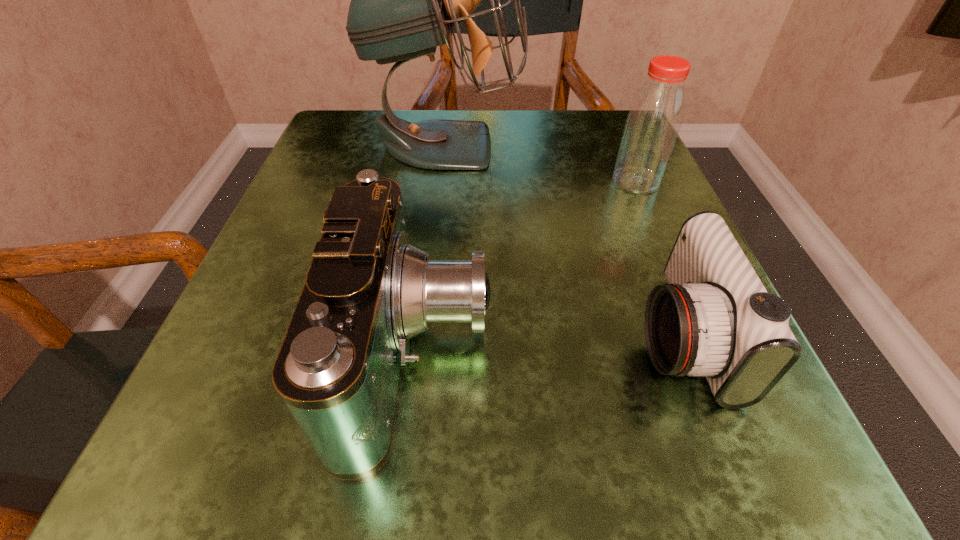
Where is `object that is at the near left corner`? object that is at the near left corner is located at coordinates (368, 291).

Locate an element on the screen. Image resolution: width=960 pixels, height=540 pixels. object present at the far right corner is located at coordinates (655, 116).

Find the location of a particular element. The image size is (960, 540). free space at the far edge of the desktop is located at coordinates (514, 148).

In the image, there is a desktop. Where is `vacant space at the near edge`? The image size is (960, 540). vacant space at the near edge is located at coordinates (493, 454).

Image resolution: width=960 pixels, height=540 pixels. In the image, there is a desktop. Identify the location of free region at the left edge. (228, 426).

In the image, there is a desktop. In order to click on vacant region at the far left corner in this screenshot , I will do `click(338, 164)`.

At what (x,y) coordinates should I click in order to perform the action: click on vacant space at the near left corner. Please return your answer as a coordinate pair (x, y). Looking at the image, I should click on (226, 482).

You are a GUI agent. You are given a task and a screenshot of the screen. Output one action in this format:
    pyautogui.click(x=<x>, y=<y>)
    Task: Click on the vacant space at the far right corner
    The height and width of the screenshot is (540, 960).
    Given the screenshot: What is the action you would take?
    pyautogui.click(x=564, y=138)

I want to click on vacant area between the second shortest object and the shorter camcorder, so click(x=549, y=345).

This screenshot has width=960, height=540. I want to click on vacant region between the taller camcorder and the bottle, so click(527, 267).